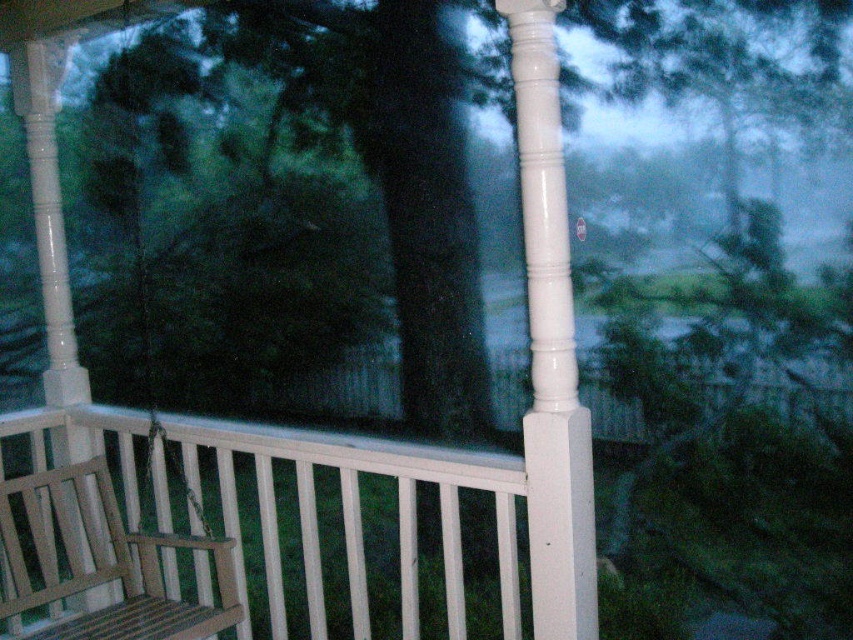
Does white painted wooden post at center have a lesser width compared to teak wood rocking chair at lower left?

Correct, white painted wooden post at center's width is less than teak wood rocking chair at lower left's.

Between point (564, 378) and point (171, 547), which one is positioned in front?

Point (564, 378)

Which is behind, point (526, 461) or point (45, 628)?

Positioned behind is point (45, 628).

The image size is (853, 640). Identify the location of white painted wooden post at center. (550, 346).